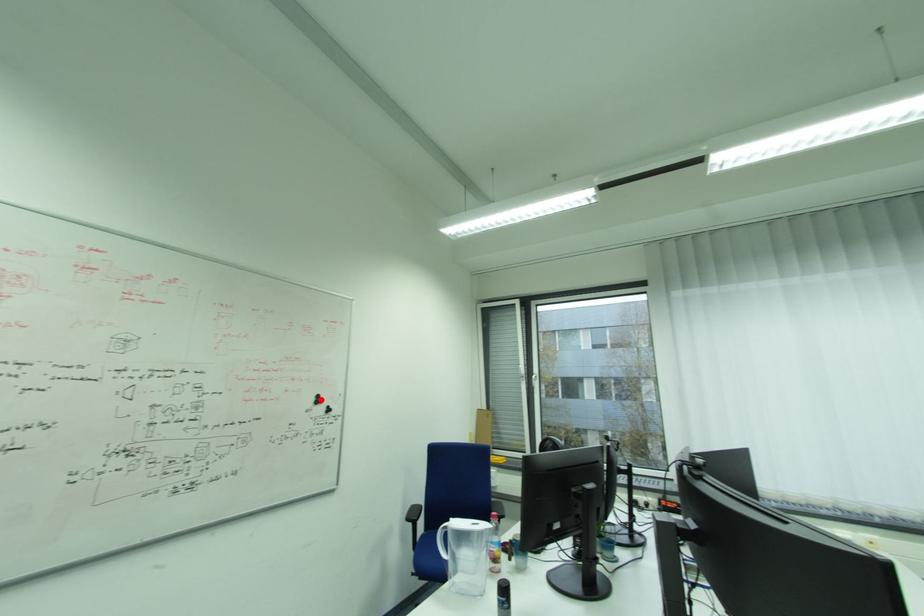
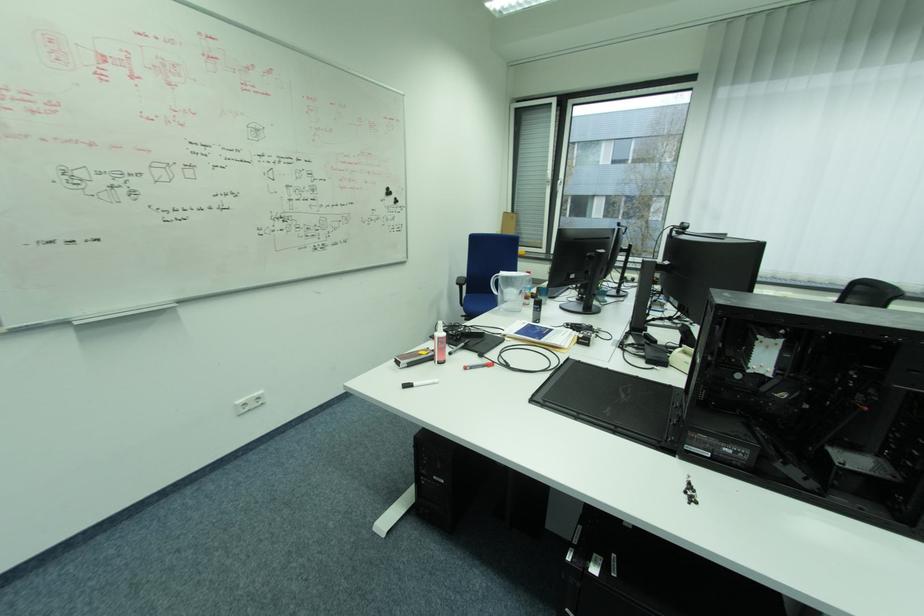
Question: I am providing you with two images of the same scene from different viewpoints. A red point is shown in image1. For the corresponding object point in image2, is it positioned nearer or farther from the camera?

Choices:
 (A) Nearer
 (B) Farther

Answer: (A)